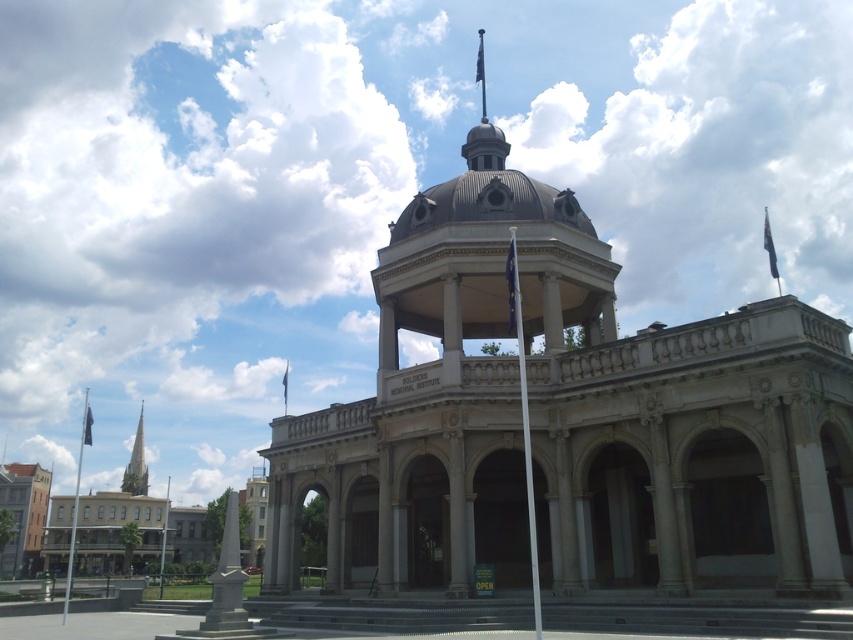
You are standing in front of the classical building and want to determine the relative positions of the flags. Which flag, the blue fabric flag at top or the black fabric flag at upper center, is closer to you?

The blue fabric flag at top is closer to you because the black fabric flag at upper center is behind it.

You are standing in front of the classical building and want to determine the relative positions of two points marked on the facade. The points are labeled as point (482, 80) and point (282, 385). Which point is closer to you?

Point (482, 80) is closer to you because it is further to the viewer than point (282, 385).